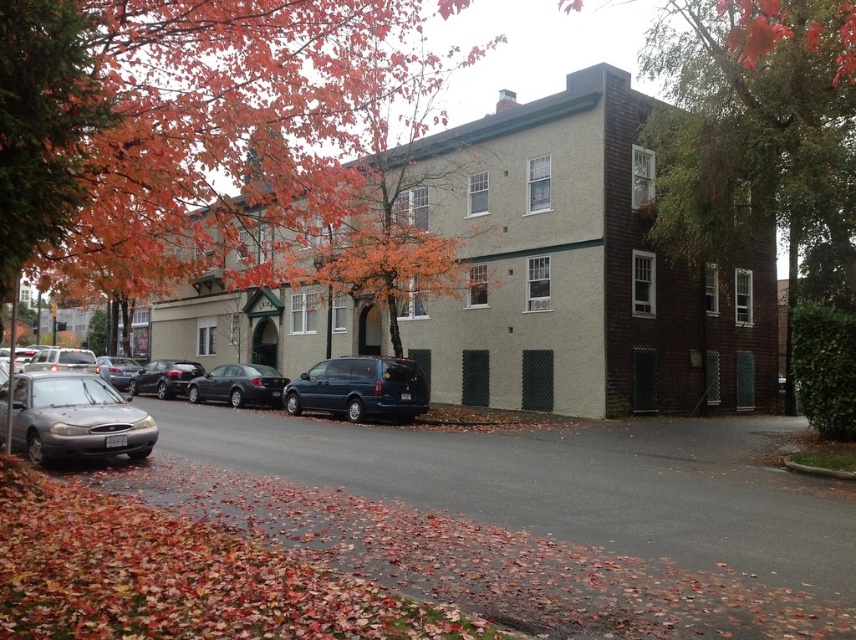
You are a delivery driver who needs to park your 2.5 meters tall truck in this street scene. The orange leafy tree at left and metallic blue minivan at center are present. Can your truck pass under the tree without hitting it?

The orange leafy tree at left is taller than the metallic blue minivan at center. Since the truck is 2.5 meters tall, and the tree is taller than the minivan, it is likely that the truck can pass under the tree without hitting it, provided the minivan is not blocking the path.

You are standing in front of the two story building with beige facade. There are two points marked on the building. One is at coordinate point [76,452] and the other is at point [102,372]. If you want to touch both points with a paintbrush, which point should you reach for first to minimize the distance traveled?

You should reach for point [76,452] first because it is closer to the camera, so you can touch it first before moving further away to reach point [102,372].

You are a delivery person trying to park a new vehicle between the metallic blue minivan at center and the shiny black sedan at center. The new vehicle is 1.8 meters wide. Can it fit in the space between them?

The metallic blue minivan at center is narrower than the shiny black sedan at center, but the exact width of the space between them isn